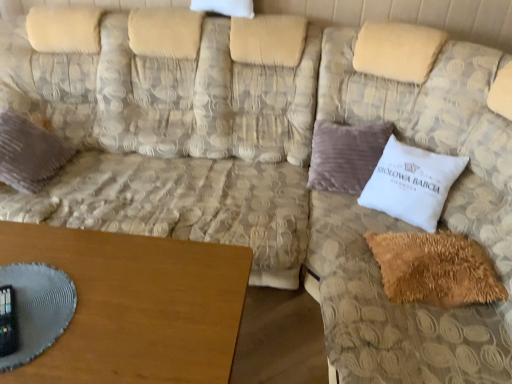
Question: Relative to white soft pillow at center right, placed as the first pillow when sorted from right to left, is brown wooden table at lower left in front or behind?

Choices:
 (A) behind
 (B) front

Answer: (B)

Question: Is brown wooden table at lower left inside or outside of white soft pillow at center right, placed as the first pillow when sorted from right to left?

Choices:
 (A) outside
 (B) inside

Answer: (A)

Question: Based on their relative distances, which object is nearer to the beige textured couch at center, the 2th couch when ordered from right to left?

Choices:
 (A) brown wooden table at lower left
 (B) white soft pillow at center right, placed as the first pillow when sorted from right to left
 (C) brown fuzzy pillow at lower right, positioned as the 2th pillow in right-to-left order
 (D) beige textured couch at upper right, marked as the 2th couch in a left-to-right arrangement
 (E) velvet purple pillow at left, which ranks as the first pillow in left-to-right order

Answer: (E)

Question: Which of these objects is positioned closest to the brown fuzzy pillow at lower right, positioned as the 2th pillow in right-to-left order?

Choices:
 (A) brown wooden table at lower left
 (B) white soft pillow at center right, placed as the first pillow when sorted from right to left
 (C) beige textured couch at upper right, marked as the 2th couch in a left-to-right arrangement
 (D) velvet purple pillow at left, which ranks as the first pillow in left-to-right order
 (E) beige textured couch at center, which appears as the first couch when viewed from the left

Answer: (C)